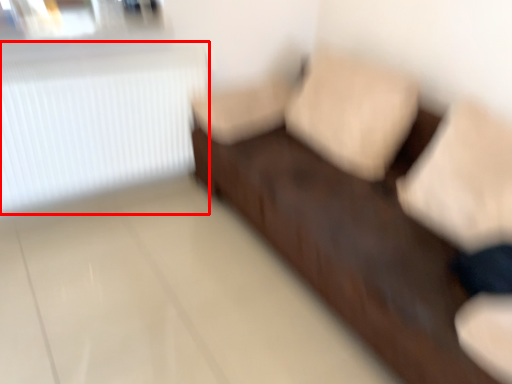
Question: Considering the relative positions of radiator (annotated by the red box) and furniture in the image provided, where is radiator (annotated by the red box) located with respect to the staircase?

Choices:
 (A) left
 (B) right

Answer: (A)